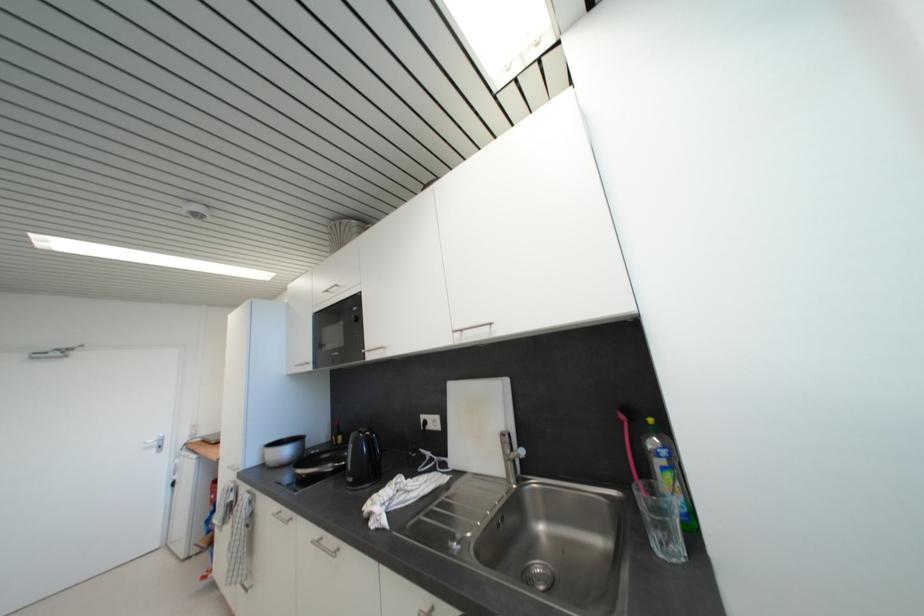
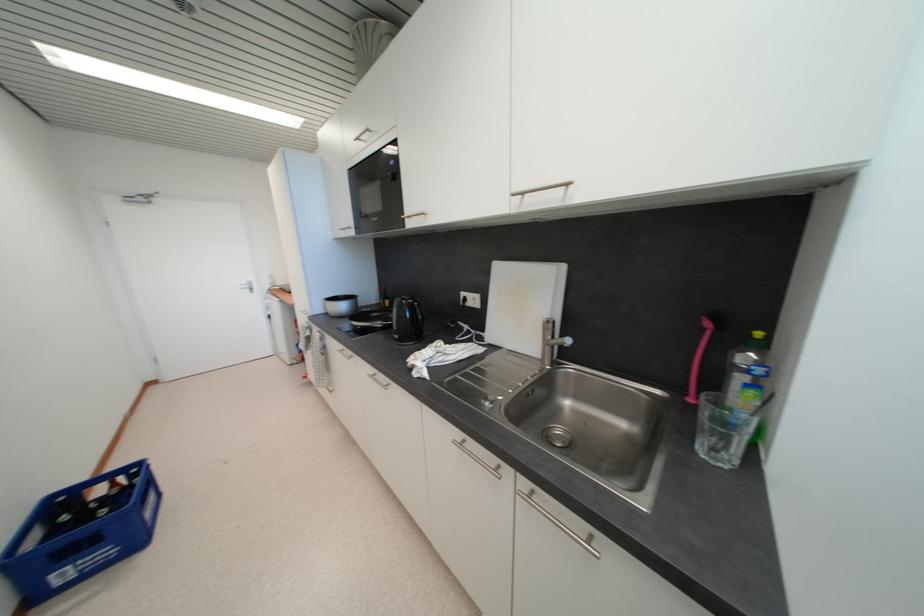
Find the pixel in the second image that matches [345,436] in the first image.

(392, 301)